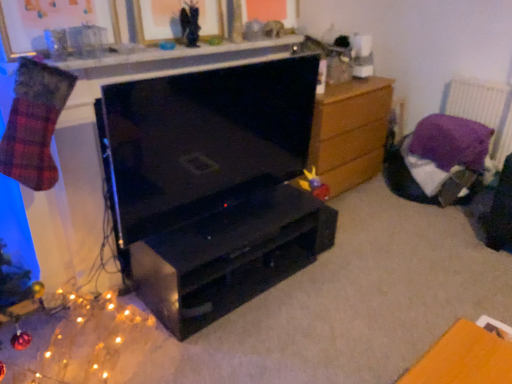
Question: Does point [x=315, y=218] appear closer or farther from the camera than point [x=245, y=46]?

Choices:
 (A) closer
 (B) farther

Answer: (B)

Question: Considering the positions of black matte desk at center and smooth white counter at upper center in the image, is black matte desk at center taller or shorter than smooth white counter at upper center?

Choices:
 (A) tall
 (B) short

Answer: (A)

Question: Considering the real-world distances, which object is closest to the smooth white counter at upper center?

Choices:
 (A) plush yellow duck at center, which is the second toy from front to back
 (B) black glossy tv at center
 (C) glittering gold lights at lower left
 (D) matte black angel at upper center, positioned as the 2th toy in bottom-to-top order
 (E) purple fabric at upper right

Answer: (D)

Question: Estimate the real-world distances between objects in this image. Which object is closer to the wooden picture frame at upper center, which is the second picture frame from right to left?

Choices:
 (A) black matte desk at center
 (B) glittering gold lights at lower left
 (C) matte black angel at upper center, the first toy when ordered from left to right
 (D) wooden chest of drawers at right
 (E) plush yellow duck at center, marked as the first toy in a right-to-left arrangement

Answer: (C)